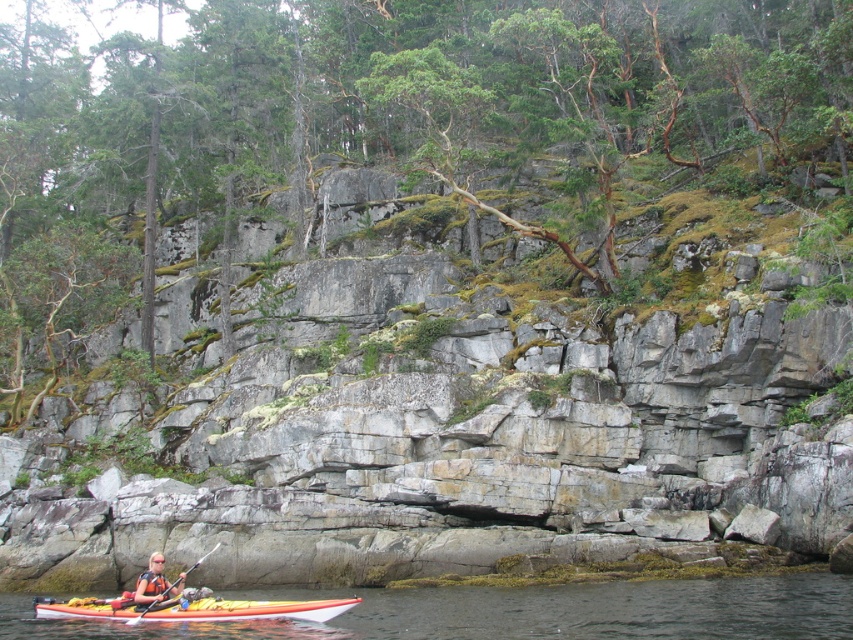
Question: Among these objects, which one is farthest from the camera?

Choices:
 (A) wooden paddle at lower center
 (B) green mossy rock at center

Answer: (B)

Question: Among these points, which one is farthest from the camera?

Choices:
 (A) (140, 600)
 (B) (136, 621)

Answer: (A)

Question: Does gray rock cliff at center appear over clear water at lower center?

Choices:
 (A) yes
 (B) no

Answer: (A)

Question: Does orange life vest at lower left have a larger size compared to wooden paddle at lower center?

Choices:
 (A) yes
 (B) no

Answer: (A)

Question: Does clear water at lower center have a lesser width compared to wooden paddle at lower center?

Choices:
 (A) no
 (B) yes

Answer: (A)

Question: Estimate the real-world distances between objects in this image. Which object is closer to the orange life vest at lower left?

Choices:
 (A) orange kayak at lower center
 (B) clear water at lower center
 (C) gray rock cliff at center

Answer: (A)